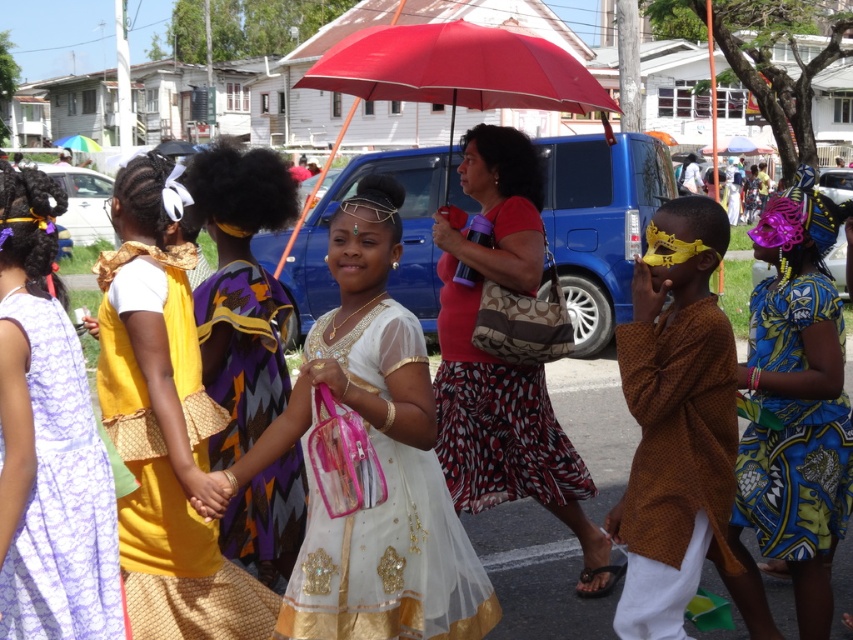
Looking at this image, can you confirm if white sheer dress at center is shorter than blue printed fabric dress at right?

In fact, white sheer dress at center may be taller than blue printed fabric dress at right.

Between point (383, 388) and point (750, 355), which one is positioned in front?

Positioned in front is point (383, 388).

Which is behind, point (442, 528) or point (833, 445)?

Positioned behind is point (833, 445).

Locate an element on the screen. white sheer dress at center is located at coordinates (376, 458).

How distant is white sheer dress at center from matte yellow dress at center?

The distance of white sheer dress at center from matte yellow dress at center is 18.01 inches.

Which of these two, white sheer dress at center or matte yellow dress at center, stands taller?

With more height is matte yellow dress at center.

Who is more distant from viewer, (433, 618) or (219, 272)?

Positioned behind is point (219, 272).

Find the location of a particular element. white sheer dress at center is located at coordinates (376, 458).

Does red fabric umbrella at center have a lesser width compared to lace fabric dress at left?

Incorrect, red fabric umbrella at center's width is not less than lace fabric dress at left's.

Measure the distance between red fabric umbrella at center and camera.

They are 3.68 meters apart.

Locate an element on the screen. The height and width of the screenshot is (640, 853). red fabric umbrella at center is located at coordinates (503, 360).